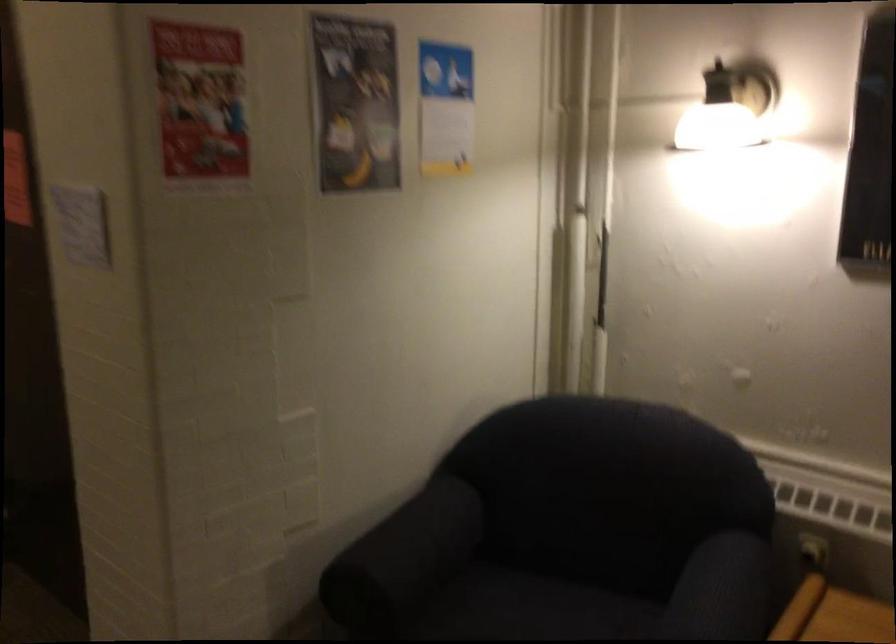
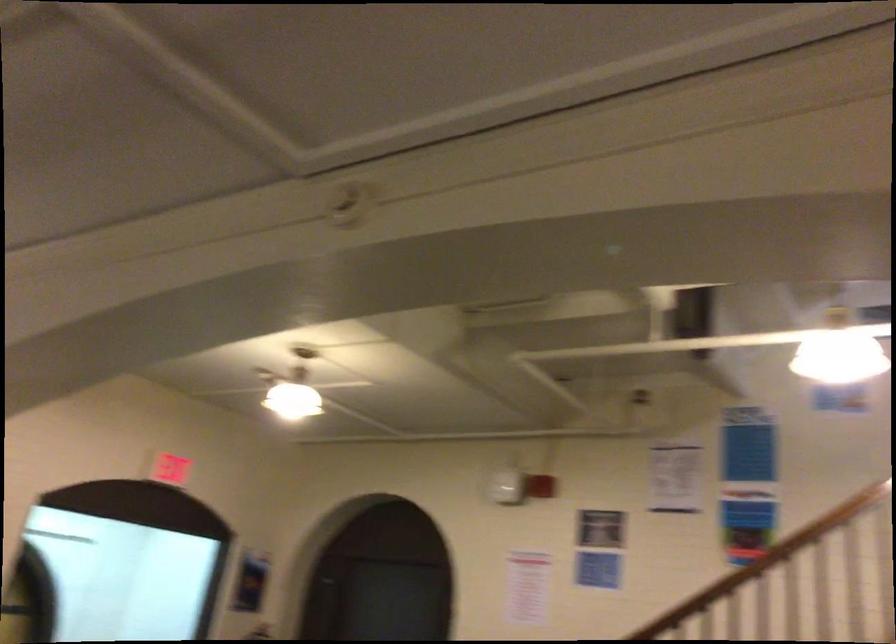
How did the camera likely rotate?

The rotation direction of the camera is left-up.